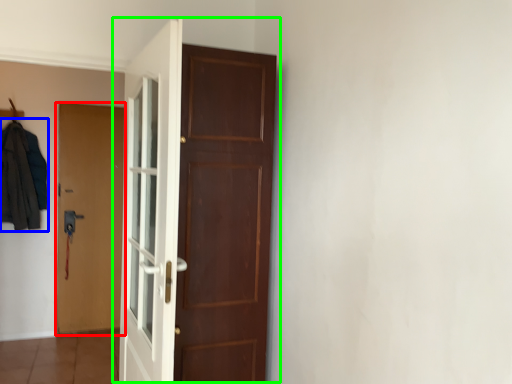
Question: Which object is positioned closest to door (highlighted by a red box)? Select from clothing (highlighted by a blue box) and door (highlighted by a green box).

Choices:
 (A) clothing
 (B) door

Answer: (A)